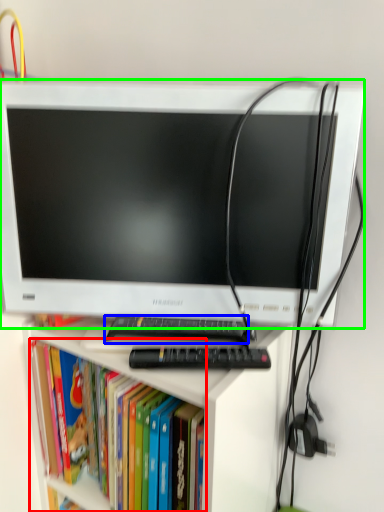
Question: Estimate the real-world distances between objects in this image. Which object is farther from book (highlighted by a red box), keyboard (highlighted by a blue box) or computer monitor (highlighted by a green box)?

Choices:
 (A) keyboard
 (B) computer monitor

Answer: (B)